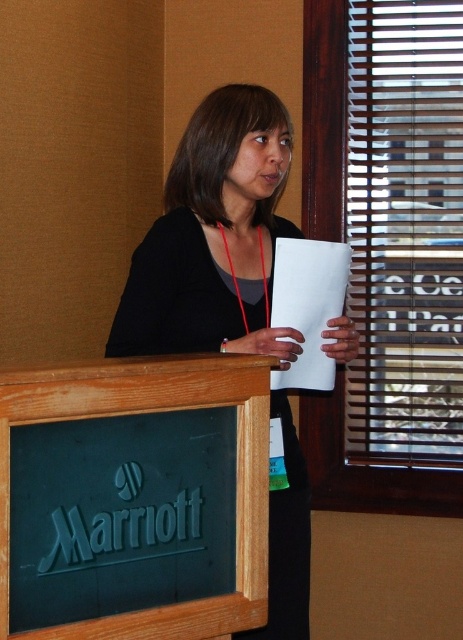
Question: Can you confirm if black matte paper at center is wider than green matte sign at lower left?

Choices:
 (A) yes
 (B) no

Answer: (A)

Question: Which point is closer to the camera?

Choices:
 (A) (x=4, y=420)
 (B) (x=308, y=588)

Answer: (A)

Question: Is black matte paper at center smaller than green matte sign at lower left?

Choices:
 (A) yes
 (B) no

Answer: (B)

Question: Is black matte paper at center wider than green matte sign at lower left?

Choices:
 (A) no
 (B) yes

Answer: (B)

Question: Which point is closer to the camera?

Choices:
 (A) (31, 428)
 (B) (282, 627)

Answer: (A)